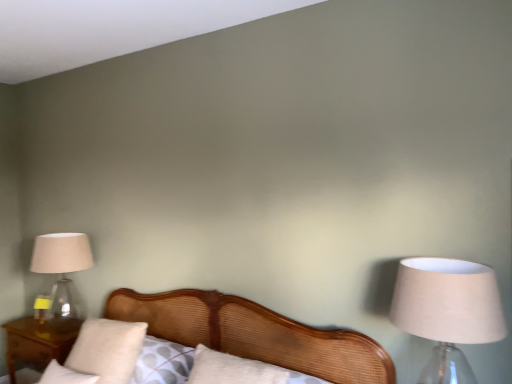
Question: Is wooden nightstand at lower left smaller than white soft pillow at lower left, which ranks as the second pillow in top-to-bottom order?

Choices:
 (A) no
 (B) yes

Answer: (A)

Question: Is wooden nightstand at lower left oriented towards white soft pillow at lower left, marked as the first pillow in a bottom-to-top arrangement?

Choices:
 (A) no
 (B) yes

Answer: (A)

Question: Does wooden nightstand at lower left have a greater width compared to white soft pillow at lower left, marked as the first pillow in a bottom-to-top arrangement?

Choices:
 (A) no
 (B) yes

Answer: (B)

Question: From a real-world perspective, is wooden nightstand at lower left positioned over white soft pillow at lower left, marked as the first pillow in a bottom-to-top arrangement, based on gravity?

Choices:
 (A) no
 (B) yes

Answer: (A)

Question: From a real-world perspective, does wooden nightstand at lower left sit lower than white soft pillow at lower left, marked as the first pillow in a bottom-to-top arrangement?

Choices:
 (A) no
 (B) yes

Answer: (B)

Question: Looking at the image, does white soft pillow at lower left, the first pillow positioned from the top, seem bigger or smaller compared to wooden bed at center?

Choices:
 (A) big
 (B) small

Answer: (B)

Question: Choose the correct answer: Is white soft pillow at lower left, the first pillow positioned from the top, inside wooden bed at center or outside it?

Choices:
 (A) inside
 (B) outside

Answer: (A)

Question: Looking at their shapes, would you say white soft pillow at lower left, which is the second pillow in bottom-to-top order, is wider or thinner than wooden bed at center?

Choices:
 (A) thin
 (B) wide

Answer: (A)

Question: Relative to wooden bed at center, is white soft pillow at lower left, which is the second pillow in bottom-to-top order, in front or behind?

Choices:
 (A) behind
 (B) front

Answer: (A)

Question: In terms of height, does white soft pillow at lower left, which is the second pillow in bottom-to-top order, look taller or shorter compared to white soft pillow at lower left, which ranks as the second pillow in top-to-bottom order?

Choices:
 (A) short
 (B) tall

Answer: (B)

Question: From a real-world perspective, is white soft pillow at lower left, the first pillow positioned from the top, positioned above or below white soft pillow at lower left, which ranks as the second pillow in top-to-bottom order?

Choices:
 (A) above
 (B) below

Answer: (A)

Question: Considering their positions, is white soft pillow at lower left, the first pillow positioned from the top, located in front of or behind white soft pillow at lower left, marked as the first pillow in a bottom-to-top arrangement?

Choices:
 (A) front
 (B) behind

Answer: (B)

Question: Based on their positions, is white soft pillow at lower left, the first pillow positioned from the top, located to the left or right of white soft pillow at lower left, marked as the first pillow in a bottom-to-top arrangement?

Choices:
 (A) right
 (B) left

Answer: (A)

Question: Considering the positions of point (300, 349) and point (474, 279), is point (300, 349) closer or farther from the camera than point (474, 279)?

Choices:
 (A) closer
 (B) farther

Answer: (B)

Question: Is wooden bed at center wider or thinner than beige fabric lampshade at right, the 1th lamp when ordered from front to back?

Choices:
 (A) wide
 (B) thin

Answer: (A)